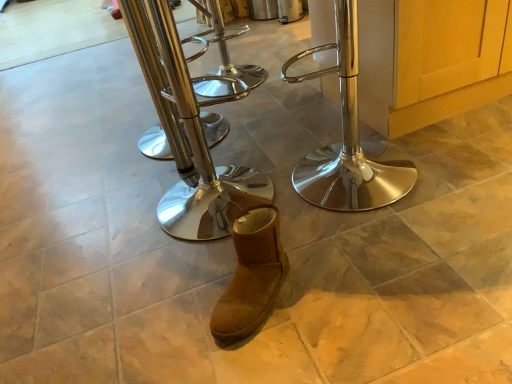
The height and width of the screenshot is (384, 512). What are the coordinates of `vacant area located to the right-hand side of polished chrome stool at center, which appears as the 1th step stool when viewed from the right` in the screenshot? It's located at (460, 163).